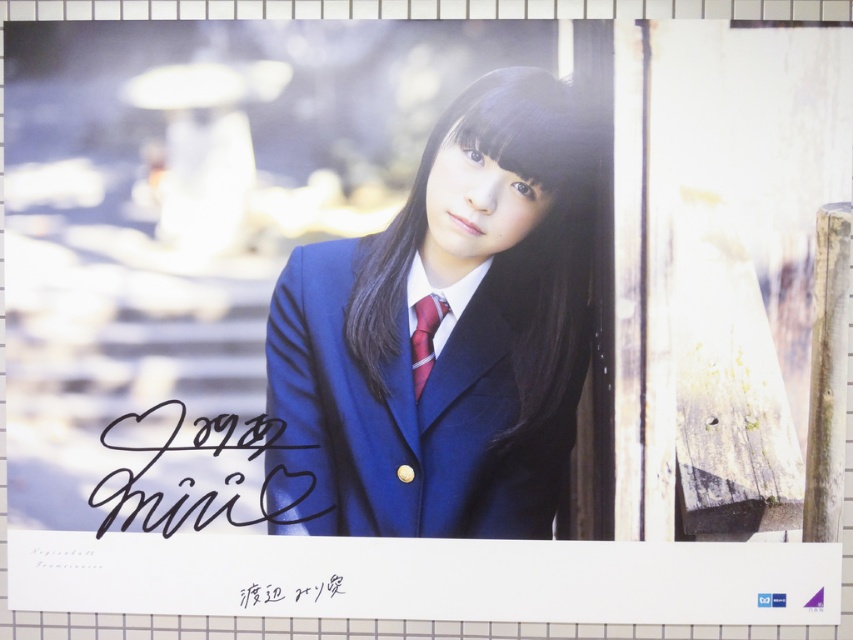
Question: Is matte blue blazer at center to the left of shiny red tie at center from the viewer's perspective?

Choices:
 (A) no
 (B) yes

Answer: (A)

Question: Which point is closer to the camera?

Choices:
 (A) (123, 445)
 (B) (316, 600)

Answer: (A)

Question: Does matte blue blazer at center have a larger size compared to black ink signature at center?

Choices:
 (A) yes
 (B) no

Answer: (A)

Question: Is shiny red tie at center to the left of black ink signature at lower center from the viewer's perspective?

Choices:
 (A) yes
 (B) no

Answer: (B)

Question: Which object is farther from the camera taking this photo?

Choices:
 (A) matte blue blazer at center
 (B) black ink signature at center
 (C) black ink signature at lower center
 (D) shiny red tie at center

Answer: (C)

Question: Which point is farther to the camera?

Choices:
 (A) (257, 589)
 (B) (120, 499)
 (C) (427, 314)
 (D) (393, 449)

Answer: (A)